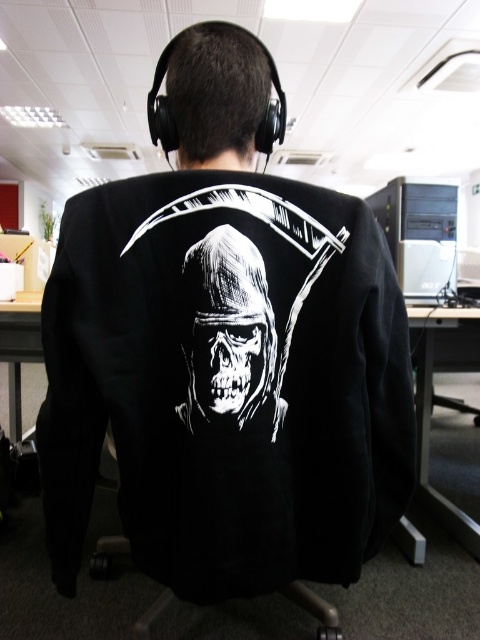
You are an office worker who needs to place a 75 centimeter long cable between the white glossy skull at center and the black plastic computer tower at right. Can you fit the cable between them?

The white glossy skull at center and the black plastic computer tower at right are 75.18 centimeters apart from each other, so yes, the 75 centimeter long cable can fit between them since it is slightly shorter than the distance between the two objects.

You are an office worker who needs to locate the white glossy skull at center and the black plastic computer tower at right. From your perspective, which object is closer to the left side of the desk?

The white glossy skull at center is closer to the left side of the desk because it is positioned to the left of the black plastic computer tower at right.

You are an office worker who needs to place a new rectangular box that is 10 cm wide on your desk. You see the white glossy skull at center and the black plastic computer tower at right. Which object can the box fit next to without overlapping?

The white glossy skull at center is thinner than the black plastic computer tower at right, so the box can fit next to the white glossy skull at center.